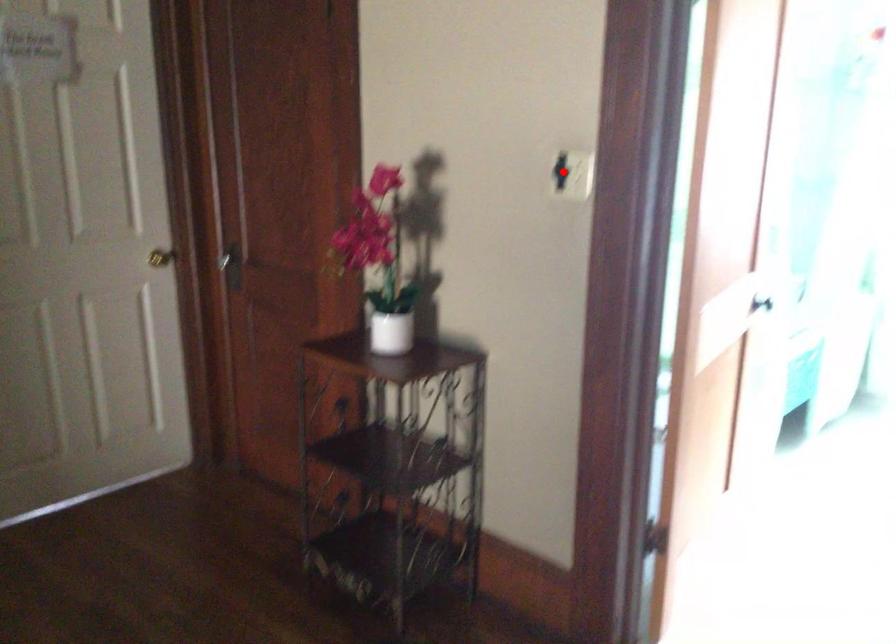
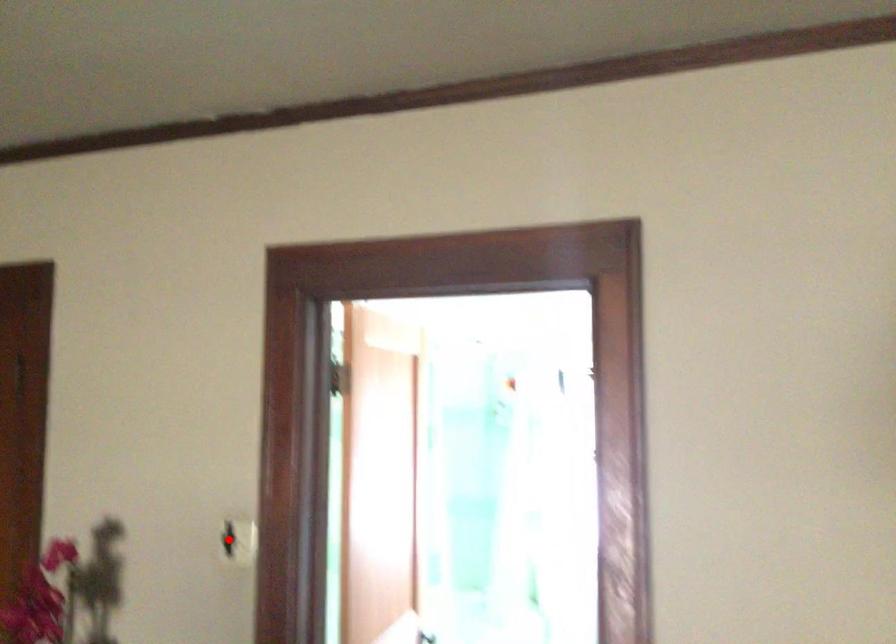
I am providing you with two images of the same scene from different viewpoints. A red point is marked on the first image and another point is marked on the second image. Is the red point in image1 aligned with the point shown in image2?

Yes